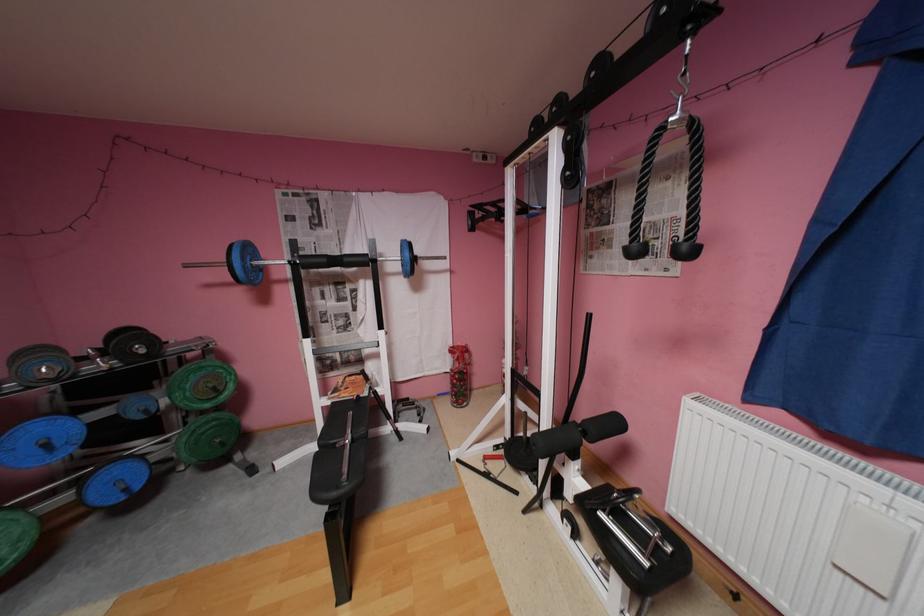
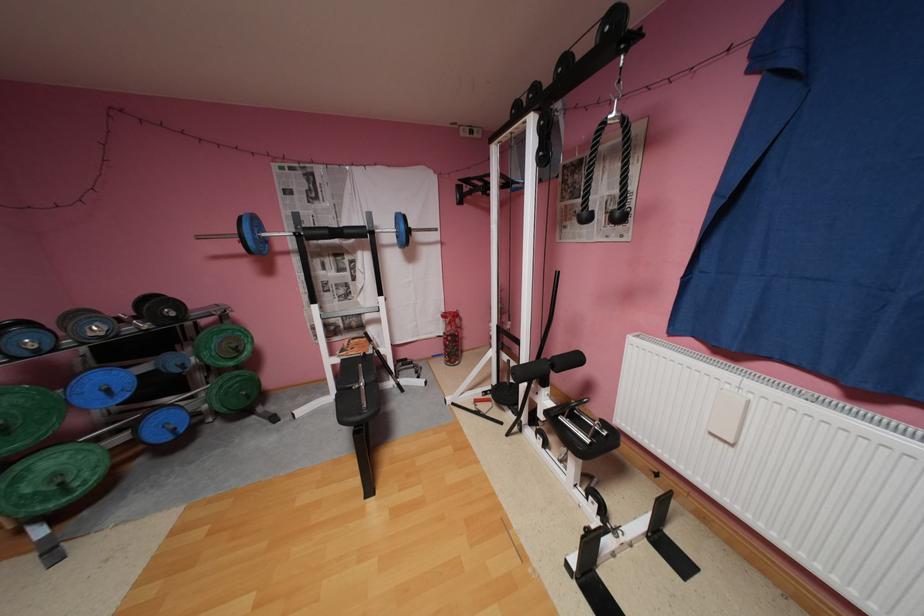
Question: What movement of the cameraman would produce the second image?

Choices:
 (A) Left
 (B) Right
 (C) Forward
 (D) Backward

Answer: (D)